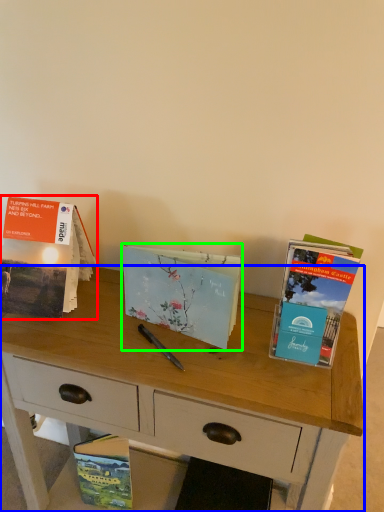
Question: Which object is positioned closest to book (highlighted by a red box)? Select from desk (highlighted by a blue box) and book (highlighted by a green box).

Choices:
 (A) desk
 (B) book

Answer: (B)